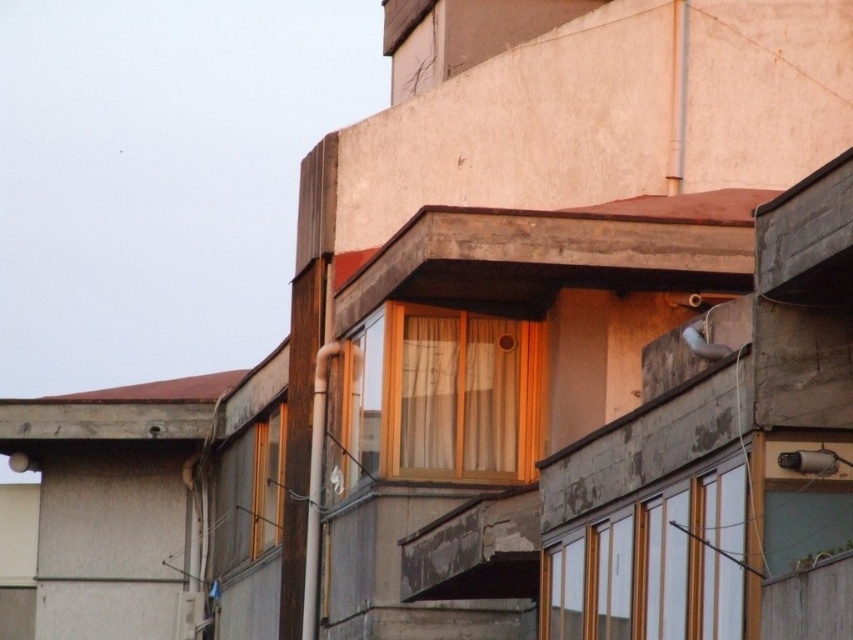
Can you confirm if translucent beige curtain at center is bigger than wooden frame window at center?

Actually, translucent beige curtain at center might be smaller than wooden frame window at center.

Measure the distance between translucent beige curtain at center and camera.

They are 72.82 meters apart.

Between point (457, 474) and point (283, 428), which one is positioned in front?

Point (457, 474) is in front.

You are a GUI agent. You are given a task and a screenshot of the screen. Output one action in this format:
    pyautogui.click(x=<x>, y=<y>)
    Task: Click on the translucent beige curtain at center
    This screenshot has height=640, width=853.
    Given the screenshot: What is the action you would take?
    pyautogui.click(x=462, y=394)

Does white matte window at center appear under white matte bird at upper right?

Yes, white matte window at center is below white matte bird at upper right.

The height and width of the screenshot is (640, 853). In order to click on white matte window at center in this screenshot , I will do `click(653, 561)`.

Who is more distant from viewer, [706,570] or [698,323]?

Point [698,323]

Locate an element on the screen. This screenshot has height=640, width=853. white matte window at center is located at coordinates (653, 561).

Is wooden frame window at center closer to the viewer compared to white matte bird at upper right?

That is False.

Which is below, wooden frame window at center or white matte bird at upper right?

wooden frame window at center is lower down.

Is point (250, 545) positioned before point (695, 349)?

No, (250, 545) is behind (695, 349).

This screenshot has height=640, width=853. In order to click on wooden frame window at center in this screenshot , I will do `click(268, 481)`.